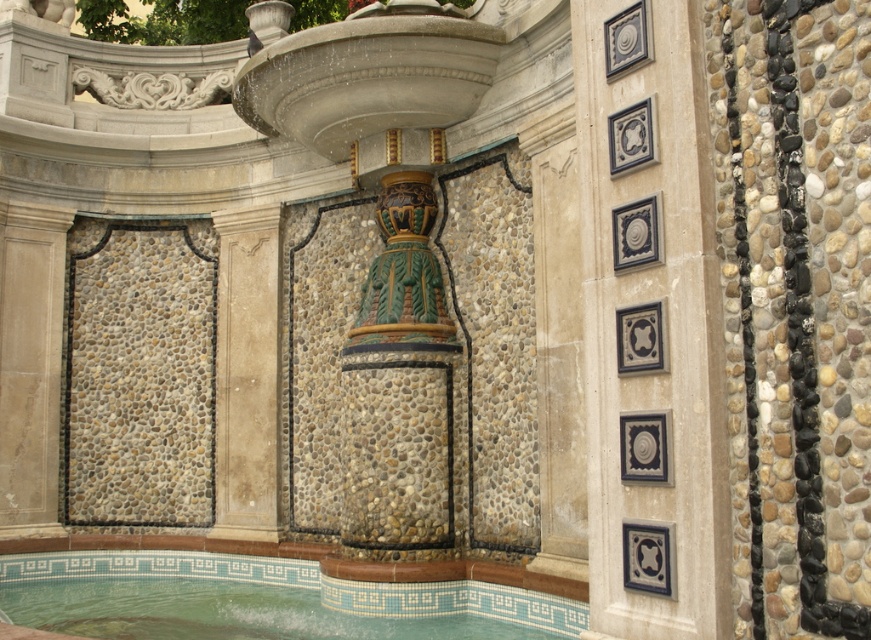
You are standing in front of the fountain and want to place a small statue on the highest point. Which object should you place it on between the dark gray stone tiles at center and the green mosaic tile pool at center?

The dark gray stone tiles at center is much taller than the green mosaic tile pool at center, so you should place the statue on the dark gray stone tiles at center.

You are a maintenance worker tasked with cleaning the fountain. You have a 12 meter hose. Can you reach from the dark gray stone tiles at center to the green mosaic tile pool at center with your hose?

The distance between the dark gray stone tiles at center and the green mosaic tile pool at center is 13.74 meters, which is longer than the 12 meter hose. Therefore, the hose cannot reach.